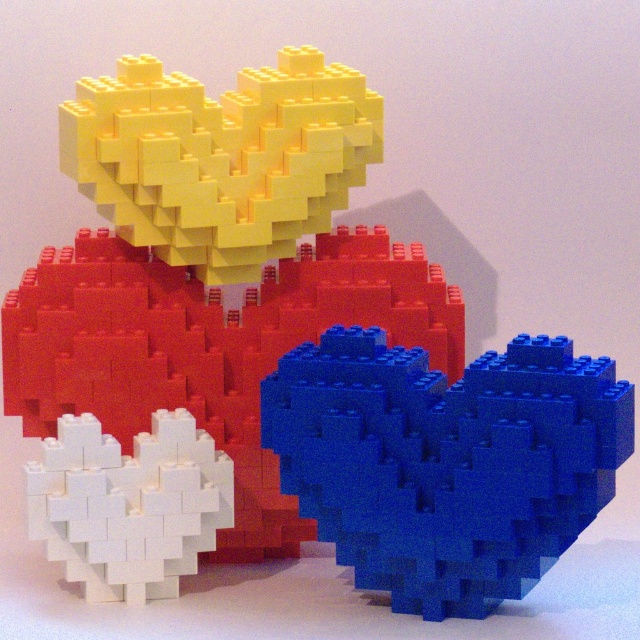
Between point (472, 451) and point (32, 468), which one is positioned in front?

Point (472, 451) is more forward.

The image size is (640, 640). Describe the element at coordinates (445, 461) in the screenshot. I see `blue matte heart at center` at that location.

Locate an element on the screen. blue matte heart at center is located at coordinates (445, 461).